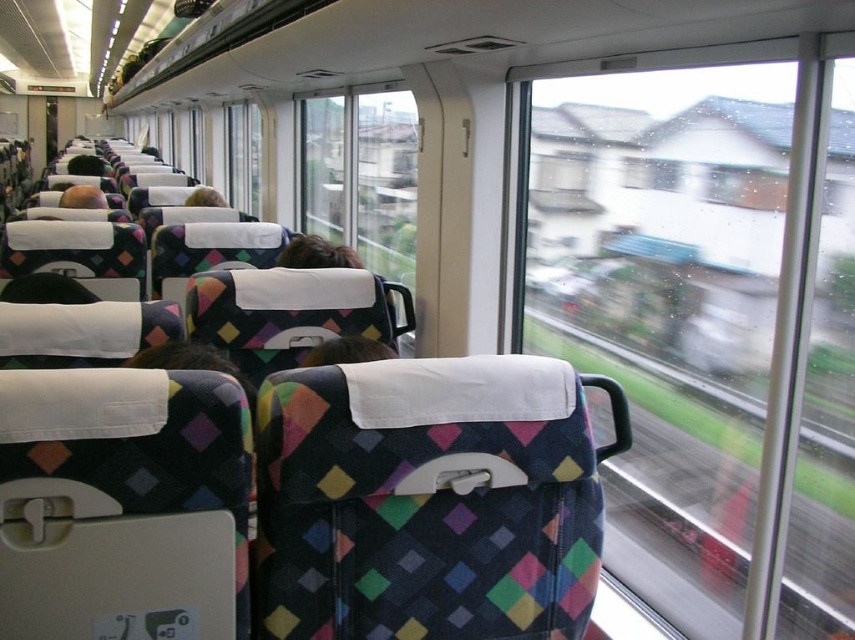
Can you confirm if transparent glass window at center is positioned above matte black hair at left?

No, transparent glass window at center is not above matte black hair at left.

Which is in front, point (803, 176) or point (80, 188)?

Point (803, 176) is more forward.

Where is `transparent glass window at center`? transparent glass window at center is located at coordinates (706, 317).

Locate an element on the screen. transparent glass window at center is located at coordinates (706, 317).